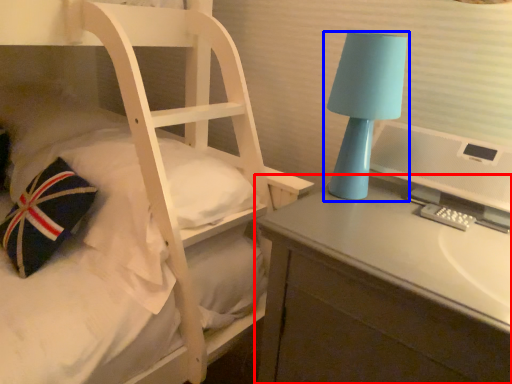
Question: Which object appears closest to the camera in this image, desk (highlighted by a red box) or lamp (highlighted by a blue box)?

Choices:
 (A) desk
 (B) lamp

Answer: (A)